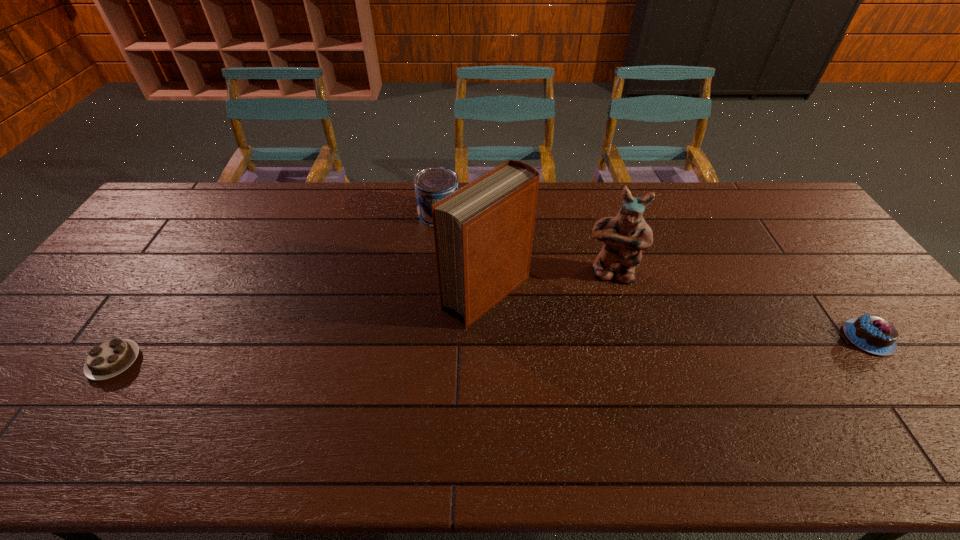
This screenshot has width=960, height=540. Find the location of `vacant spot on the desktop that is between the shortest object and the right chocolate cake and is positioned on the front label of the farthest object`. vacant spot on the desktop that is between the shortest object and the right chocolate cake and is positioned on the front label of the farthest object is located at coordinates (398, 353).

Where is `free spot on the desktop that is between the shorter chocolate cake and the taller chocolate cake and is positioned on the front-facing side of the second tallest object`? This screenshot has height=540, width=960. free spot on the desktop that is between the shorter chocolate cake and the taller chocolate cake and is positioned on the front-facing side of the second tallest object is located at coordinates (610, 346).

The width and height of the screenshot is (960, 540). Identify the location of vacant space on the desktop that is between the left chocolate cake and the right chocolate cake and is positioned on the open cover of the hardback book. (411, 352).